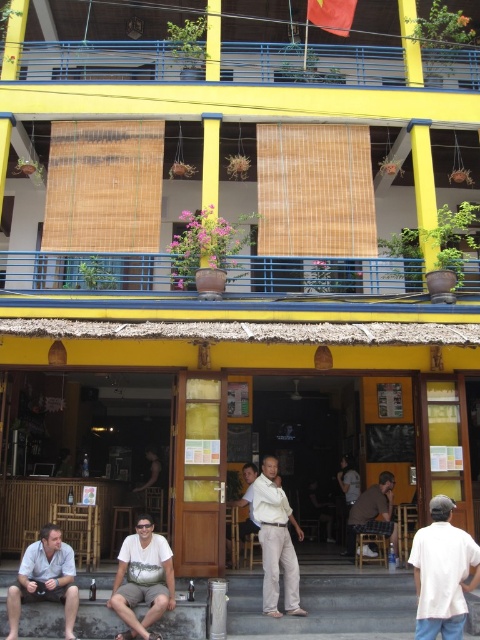
You are standing in front of the building and want to know which of the two points, point (126, 544) or point (343, 16), is closer to you. Based on the description, which point is nearer?

Point (126, 544) is closer to the viewer than point (343, 16).

You are a customer at the cafe and want to sit at a table that can accommodate both the brown fabric shirt at lower center and the dark brown leather pants at center. Which object takes up more space?

The brown fabric shirt at lower center is larger in size than the dark brown leather pants at center, so it takes up more space.